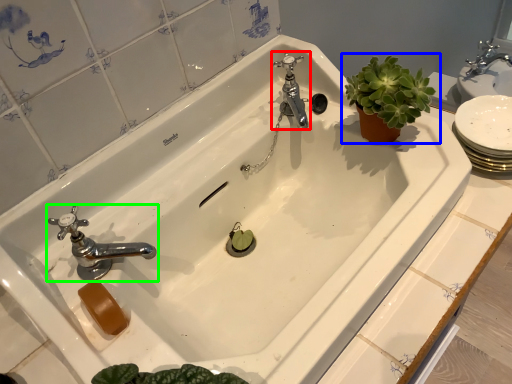
Question: Considering the real-world distances, which object is closest to tap (highlighted by a red box)? houseplant (highlighted by a blue box) or tap (highlighted by a green box).

Choices:
 (A) houseplant
 (B) tap

Answer: (A)